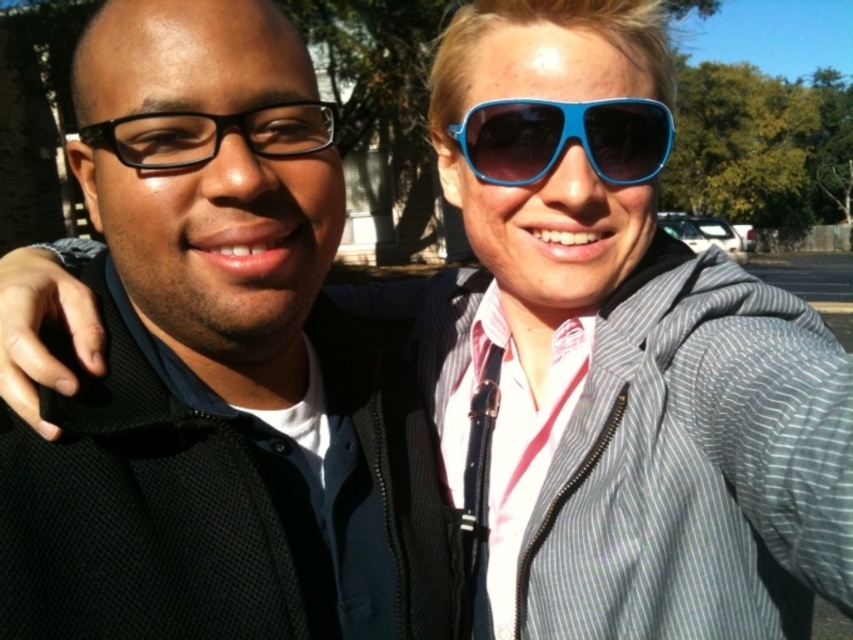
Which is more to the right, black matte jacket at center or black plastic glasses at left?

black plastic glasses at left is more to the right.

Is black matte jacket at center wider than black plastic glasses at left?

Correct, the width of black matte jacket at center exceeds that of black plastic glasses at left.

Is point (352, 333) behind point (318, 132)?

Yes, it is behind point (318, 132).

I want to click on black matte jacket at center, so click(x=219, y=372).

Is blue plastic sunglasses at upper center below black plastic glasses at left?

Incorrect, blue plastic sunglasses at upper center is not positioned below black plastic glasses at left.

Does blue plastic sunglasses at upper center have a larger size compared to black plastic glasses at left?

Incorrect, blue plastic sunglasses at upper center is not larger than black plastic glasses at left.

Where is `blue plastic sunglasses at upper center`? Image resolution: width=853 pixels, height=640 pixels. blue plastic sunglasses at upper center is located at coordinates (564, 138).

You are a GUI agent. You are given a task and a screenshot of the screen. Output one action in this format:
    pyautogui.click(x=<x>, y=<y>)
    Task: Click on the blue plastic sunglasses at upper center
    Image resolution: width=853 pixels, height=640 pixels.
    Given the screenshot: What is the action you would take?
    pyautogui.click(x=564, y=138)

Looking at this image, who is shorter, black matte jacket at center or blue plastic sunglasses at upper center?

blue plastic sunglasses at upper center

Is point (267, 260) positioned behind point (489, 172)?

No, it is in front of (489, 172).

Is point (209, 557) closer to viewer compared to point (625, 112)?

Yes.

The image size is (853, 640). What are the coordinates of `black matte jacket at center` in the screenshot? It's located at (219, 372).